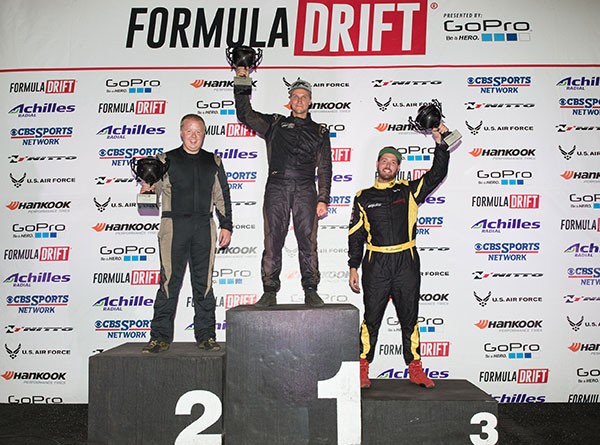
Locate an element on the screen. podiums is located at coordinates (155, 363), (275, 331), (387, 409).